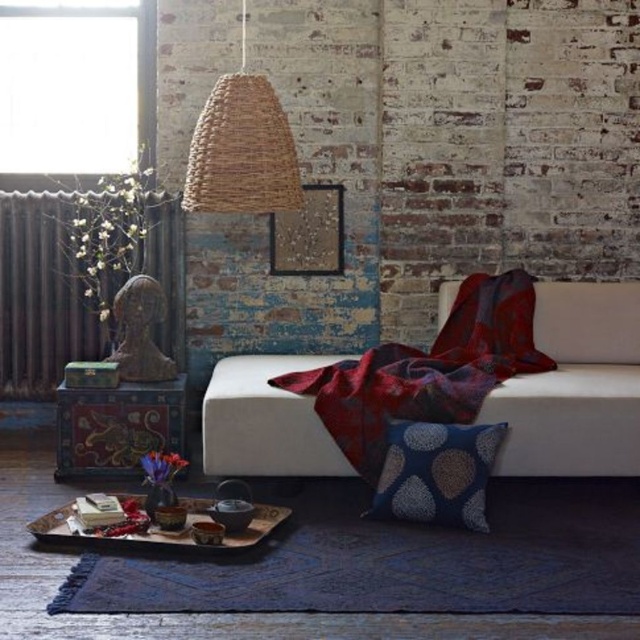
Measure the distance between transparent glass window at upper left and camera.

transparent glass window at upper left and camera are 4.46 meters apart.

Is transparent glass window at upper left shorter than blue dotted pillow at lower center?

In fact, transparent glass window at upper left may be taller than blue dotted pillow at lower center.

Which is in front, point (17, 68) or point (419, 502)?

Point (419, 502)

At what (x,y) coordinates should I click in order to perform the action: click on transparent glass window at upper left. Please return your answer as a coordinate pair (x, y). Looking at the image, I should click on (76, 84).

Can you confirm if blue dotted pillow at lower center is wider than wooden tray at lower center?

In fact, blue dotted pillow at lower center might be narrower than wooden tray at lower center.

Is blue dotted pillow at lower center below wooden tray at lower center?

Actually, blue dotted pillow at lower center is above wooden tray at lower center.

Does point (481, 529) come in front of point (125, 545)?

No, (481, 529) is further to viewer.

This screenshot has height=640, width=640. What are the coordinates of `blue dotted pillow at lower center` in the screenshot? It's located at (436, 472).

Is painted wood trunk at lower left to the left of wooden tray at lower center from the viewer's perspective?

Correct, you'll find painted wood trunk at lower left to the left of wooden tray at lower center.

Does painted wood trunk at lower left have a lesser height compared to wooden tray at lower center?

In fact, painted wood trunk at lower left may be taller than wooden tray at lower center.

Does point (70, 403) lie behind point (147, 538)?

That is True.

You are a GUI agent. You are given a task and a screenshot of the screen. Output one action in this format:
    pyautogui.click(x=<x>, y=<y>)
    Task: Click on the painted wood trunk at lower left
    Image resolution: width=640 pixels, height=640 pixels.
    Given the screenshot: What is the action you would take?
    pyautogui.click(x=116, y=426)